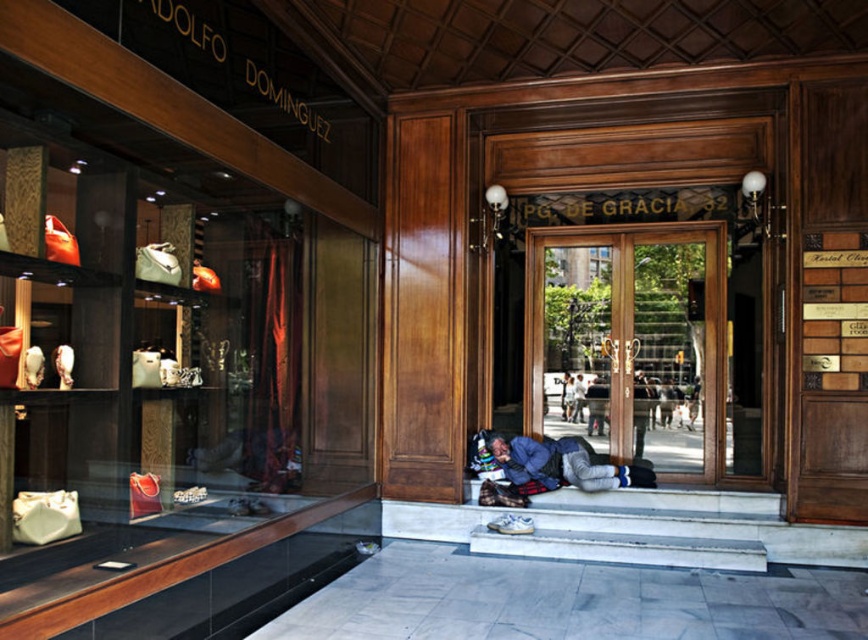
Question: Which of the following is the farthest from the observer?

Choices:
 (A) blue denim jacket at lower center
 (B) wooden door at center

Answer: (B)

Question: Is the position of wooden door at center more distant than that of blue denim jacket at lower center?

Choices:
 (A) yes
 (B) no

Answer: (A)

Question: Observing the image, what is the correct spatial positioning of wooden door at center in reference to blue denim jacket at lower center?

Choices:
 (A) right
 (B) left

Answer: (A)

Question: Is wooden door at center thinner than blue denim jacket at lower center?

Choices:
 (A) yes
 (B) no

Answer: (B)